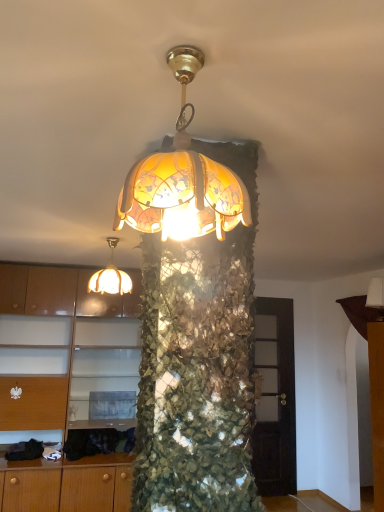
Question: Considering the relative positions of white fabric lampshade at upper right, the 3th lamp in the left-to-right sequence, and translucent glass lampshade at center, the 2th lamp in the left-to-right sequence, in the image provided, is white fabric lampshade at upper right, the 3th lamp in the left-to-right sequence, to the right of translucent glass lampshade at center, the 2th lamp in the left-to-right sequence, from the viewer's perspective?

Choices:
 (A) yes
 (B) no

Answer: (A)

Question: Could you tell me if white fabric lampshade at upper right, the 3th lamp in the left-to-right sequence, is facing translucent glass lampshade at center, the third lamp positioned from the back?

Choices:
 (A) no
 (B) yes

Answer: (A)

Question: Can we say white fabric lampshade at upper right, acting as the 3th lamp starting from the front, lies outside translucent glass lampshade at center, the second lamp when ordered from right to left?

Choices:
 (A) no
 (B) yes

Answer: (B)

Question: Is white fabric lampshade at upper right, acting as the 3th lamp starting from the front, taller than translucent glass lampshade at center, which is the first lamp in front-to-back order?

Choices:
 (A) yes
 (B) no

Answer: (B)

Question: Is white fabric lampshade at upper right, acting as the 3th lamp starting from the front, wider than translucent glass lampshade at center, the 2th lamp in the left-to-right sequence?

Choices:
 (A) no
 (B) yes

Answer: (A)

Question: Considering the relative positions of white fabric lampshade at upper right, the first lamp from the back, and translucent glass lampshade at center, the third lamp positioned from the back, in the image provided, is white fabric lampshade at upper right, the first lamp from the back, to the left or to the right of translucent glass lampshade at center, the third lamp positioned from the back,?

Choices:
 (A) left
 (B) right

Answer: (B)

Question: Looking at the image, does white fabric lampshade at upper right, the 1th lamp positioned from the right, seem bigger or smaller compared to translucent glass lampshade at center, the 2th lamp in the left-to-right sequence?

Choices:
 (A) big
 (B) small

Answer: (B)

Question: Would you say white fabric lampshade at upper right, acting as the 3th lamp starting from the front, is inside or outside translucent glass lampshade at center, the 2th lamp in the left-to-right sequence?

Choices:
 (A) inside
 (B) outside

Answer: (B)

Question: In terms of height, does white fabric lampshade at upper right, the first lamp from the back, look taller or shorter compared to translucent glass lampshade at center, which is the first lamp in front-to-back order?

Choices:
 (A) short
 (B) tall

Answer: (A)

Question: From a real-world perspective, is matte wood cabinet at left positioned above or below translucent glass lampshade at center, the second lamp when ordered from right to left?

Choices:
 (A) below
 (B) above

Answer: (A)

Question: From their relative heights in the image, would you say matte wood cabinet at left is taller or shorter than translucent glass lampshade at center, the second lamp when ordered from right to left?

Choices:
 (A) tall
 (B) short

Answer: (A)

Question: Considering their positions, is matte wood cabinet at left located in front of or behind translucent glass lampshade at center, which is the first lamp in front-to-back order?

Choices:
 (A) front
 (B) behind

Answer: (B)

Question: Does point (29, 368) appear closer or farther from the camera than point (231, 192)?

Choices:
 (A) farther
 (B) closer

Answer: (A)

Question: From a real-world perspective, is translucent glass lampshade at upper center, which ranks as the first lamp in left-to-right order, above or below white fabric lampshade at upper right, acting as the 3th lamp starting from the front?

Choices:
 (A) below
 (B) above

Answer: (B)

Question: Considering their positions, is translucent glass lampshade at upper center, which is the 2th lamp in front-to-back order, located in front of or behind white fabric lampshade at upper right, the first lamp from the back?

Choices:
 (A) front
 (B) behind

Answer: (A)